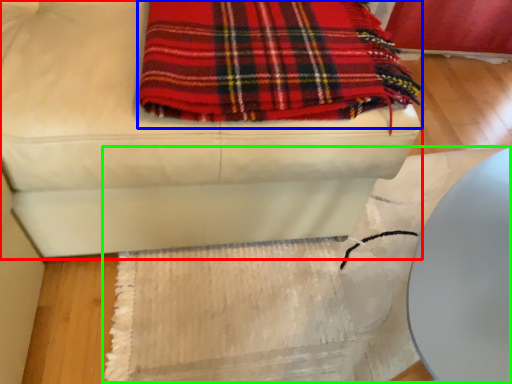
Question: Which is farther away from furniture (highlighted by a red box)? blanket (highlighted by a blue box) or mat (highlighted by a green box)?

Choices:
 (A) blanket
 (B) mat

Answer: (B)